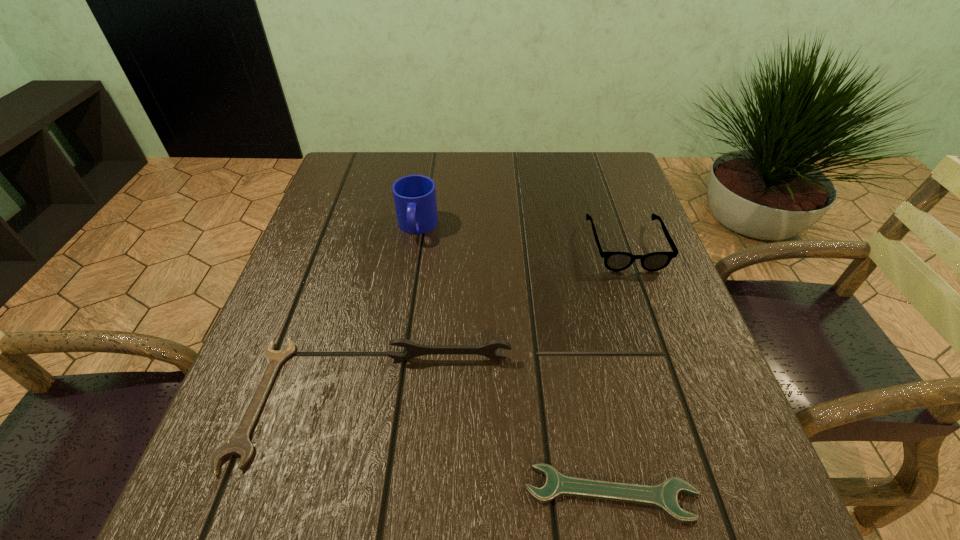
Identify the location of the tallest object. Image resolution: width=960 pixels, height=540 pixels. (414, 196).

Locate an element on the screen. spectacles is located at coordinates (614, 261).

Where is `the tallest wrench`? This screenshot has width=960, height=540. the tallest wrench is located at coordinates (488, 349).

In order to click on the rightmost wrench in this screenshot , I will do `click(663, 496)`.

Identify the location of the leftmost object. click(x=239, y=443).

Identify the location of vacant region located 0.340m on the side with the handle of the mug. This screenshot has width=960, height=540. (393, 381).

This screenshot has width=960, height=540. I want to click on free point located 0.250m on the arms of the spectacles, so click(x=671, y=376).

At what (x,y) coordinates should I click in order to perform the action: click on vacant space located 0.180m on the open ends of the tallest wrench. Please return your answer as a coordinate pair (x, y). Looking at the image, I should click on (444, 467).

Find the location of a particular element. The width and height of the screenshot is (960, 540). free point located on the left of the rightmost wrench is located at coordinates (253, 494).

Locate an element on the screen. vacant space situated 0.300m on the back of the leftmost wrench is located at coordinates coord(324,233).